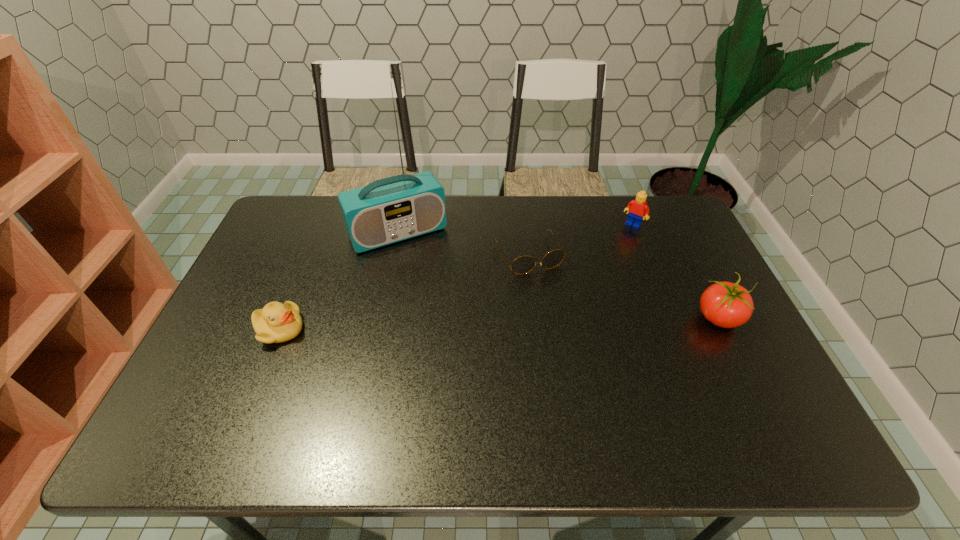
Locate an element on the screen. The image size is (960, 540). duckling is located at coordinates (275, 323).

The height and width of the screenshot is (540, 960). Find the location of `the leftmost object`. the leftmost object is located at coordinates (275, 323).

This screenshot has width=960, height=540. In order to click on the rightmost object in this screenshot , I will do `click(724, 304)`.

The height and width of the screenshot is (540, 960). I want to click on the tallest object, so click(x=400, y=207).

Find the location of a particular element. The image size is (960, 540). the second object from left to right is located at coordinates (400, 207).

In order to click on Lego in this screenshot , I will do `click(638, 207)`.

Identify the location of sunglasses. The width and height of the screenshot is (960, 540). (524, 264).

You are a GUI agent. You are given a task and a screenshot of the screen. Output one action in this format:
    pyautogui.click(x=<x>, y=<y>)
    Task: Click on the shortest object
    This screenshot has height=540, width=960.
    Given the screenshot: What is the action you would take?
    pyautogui.click(x=524, y=264)

Find the location of `vacant space located 0.100m at the face of the leftmost object`. vacant space located 0.100m at the face of the leftmost object is located at coordinates point(341,329).

At what (x,y) coordinates should I click in order to perform the action: click on vacant region located 0.210m on the left of the tomato. Please return your answer as a coordinate pair (x, y). Looking at the image, I should click on (618, 318).